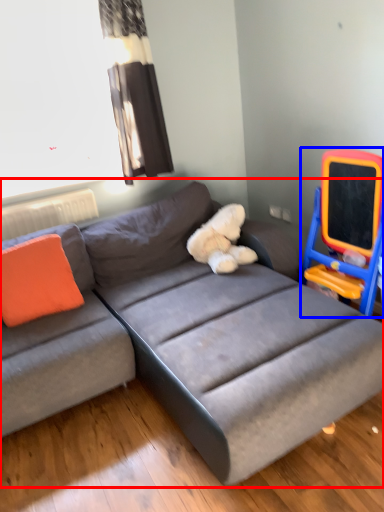
Question: Which point is closer to the camera, studio couch (highlighted by a red box) or rocking chair (highlighted by a blue box)?

Choices:
 (A) studio couch
 (B) rocking chair

Answer: (A)